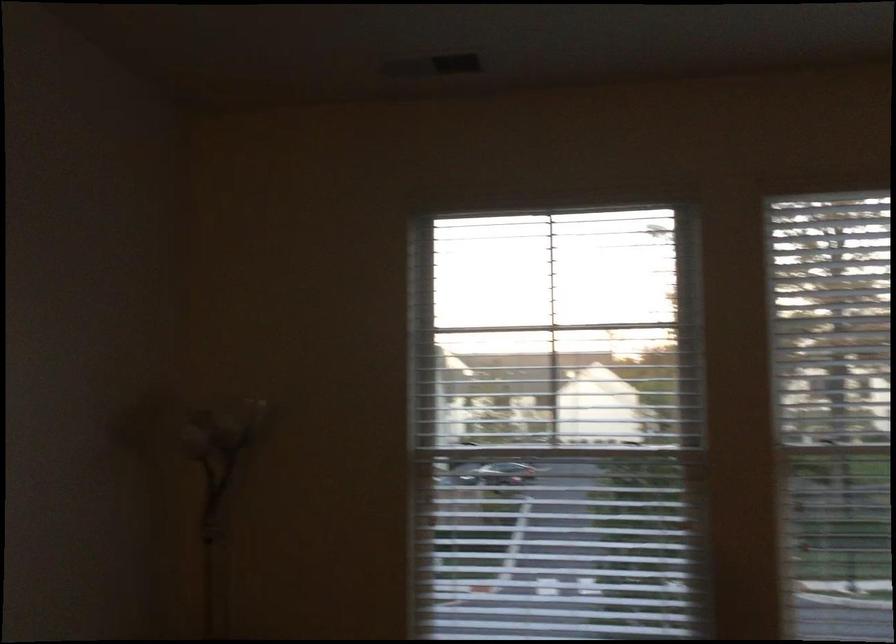
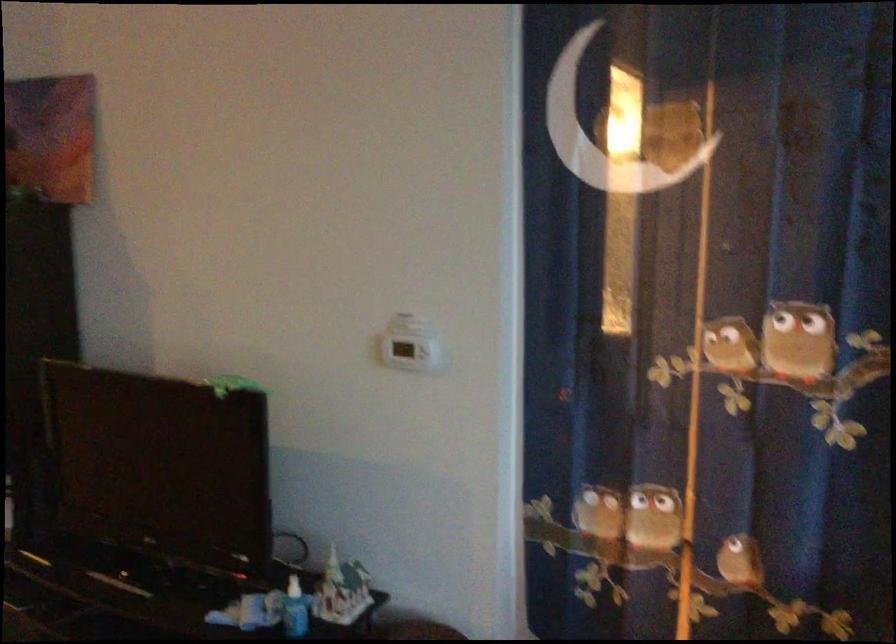
From the picture: How did the camera likely rotate?

The camera's rotation is toward left-down.